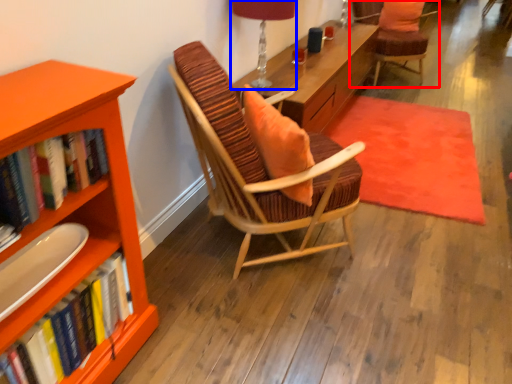
Question: Which object appears closest to the camera in this image, chair (highlighted by a red box) or table lamp (highlighted by a blue box)?

Choices:
 (A) chair
 (B) table lamp

Answer: (B)